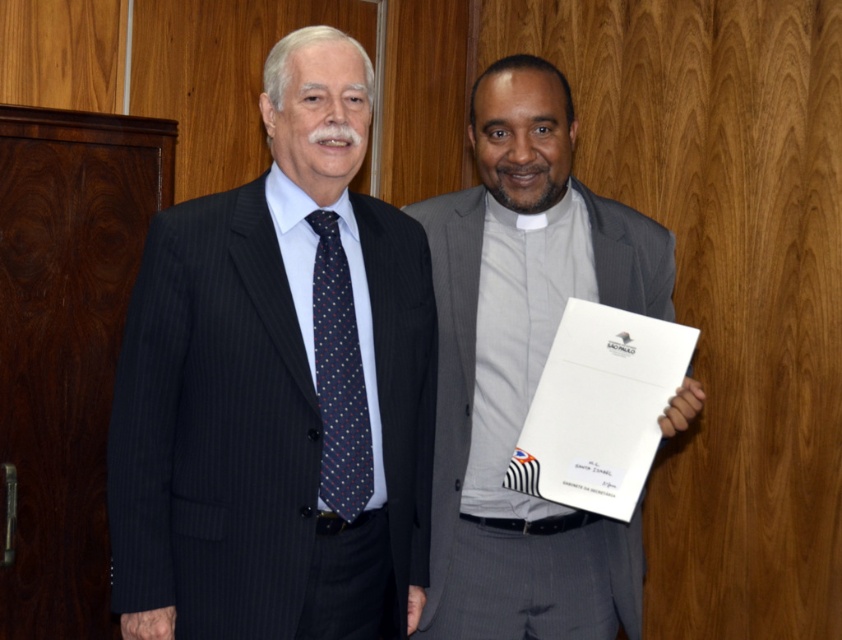
Which is in front, point (312, 282) or point (328, 404)?

Point (328, 404)

Locate an element on the screen. matte black suit at left is located at coordinates tap(278, 388).

Is gray matte suit at center above dark blue silk tie at left?

→ Indeed, gray matte suit at center is positioned over dark blue silk tie at left.

Identify the location of gray matte suit at center. point(525,369).

Can you confirm if matte black suit at left is positioned above gray matte suit at center?

Yes.

Which is behind, point (354, 456) or point (536, 154)?

Positioned behind is point (536, 154).

The image size is (842, 640). Identify the location of matte black suit at left. (278, 388).

In order to click on matte black suit at left in this screenshot , I will do `click(278, 388)`.